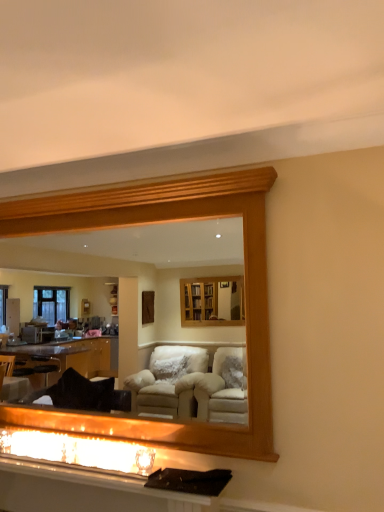
Question: In terms of size, does matte glass fireplace at lower center appear bigger or smaller than matte white vanity at lower center?

Choices:
 (A) small
 (B) big

Answer: (A)

Question: Is matte glass fireplace at lower center spatially inside matte white vanity at lower center, or outside of it?

Choices:
 (A) outside
 (B) inside

Answer: (A)

Question: Which object is the farthest from the wooden frame at upper center?

Choices:
 (A) matte glass fireplace at lower center
 (B) matte white vanity at lower center

Answer: (B)

Question: Which object is positioned closest to the matte white vanity at lower center?

Choices:
 (A) wooden frame at upper center
 (B) matte glass fireplace at lower center

Answer: (B)